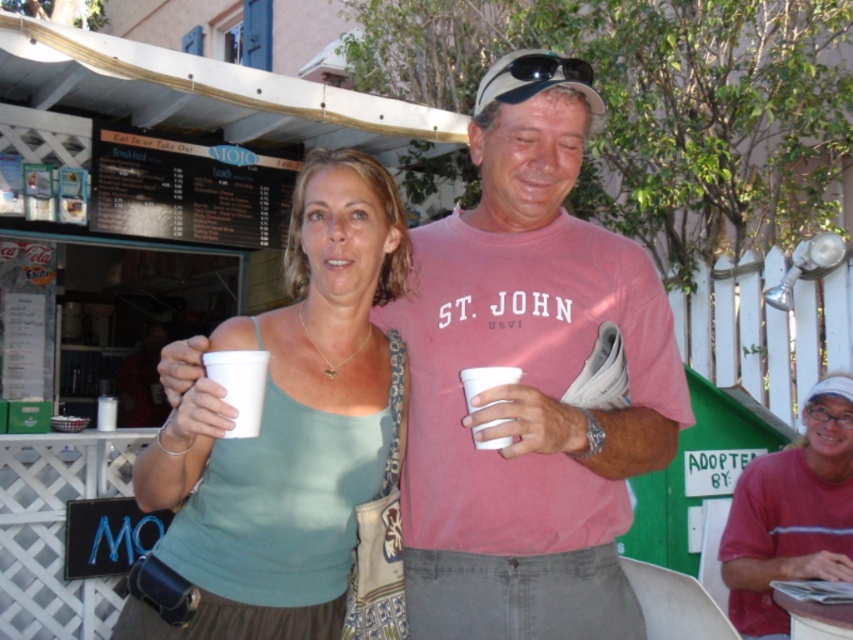
Question: Which of the following is the farthest from the observer?

Choices:
 (A) white styrofoam cup at center
 (B) white paper cup at center
 (C) matte white cup at center
 (D) pink cotton t-shirt at center

Answer: (A)

Question: Based on their relative distances, which object is farther from the matte white cup at center?

Choices:
 (A) matte green tank top at center
 (B) white styrofoam cup at center
 (C) white paper cup at center
 (D) pink cotton t-shirt at center

Answer: (A)

Question: Where is matte white cup at center located in relation to white styrofoam cup at center in the image?

Choices:
 (A) left
 (B) right

Answer: (A)

Question: Which object appears closest to the camera in this image?

Choices:
 (A) white styrofoam cup at center
 (B) matte green tank top at center

Answer: (A)

Question: Is pink cotton t-shirt at center positioned at the back of white styrofoam cup at center?

Choices:
 (A) no
 (B) yes

Answer: (A)

Question: Does pink cotton t-shirt at center appear over matte green tank top at center?

Choices:
 (A) no
 (B) yes

Answer: (B)